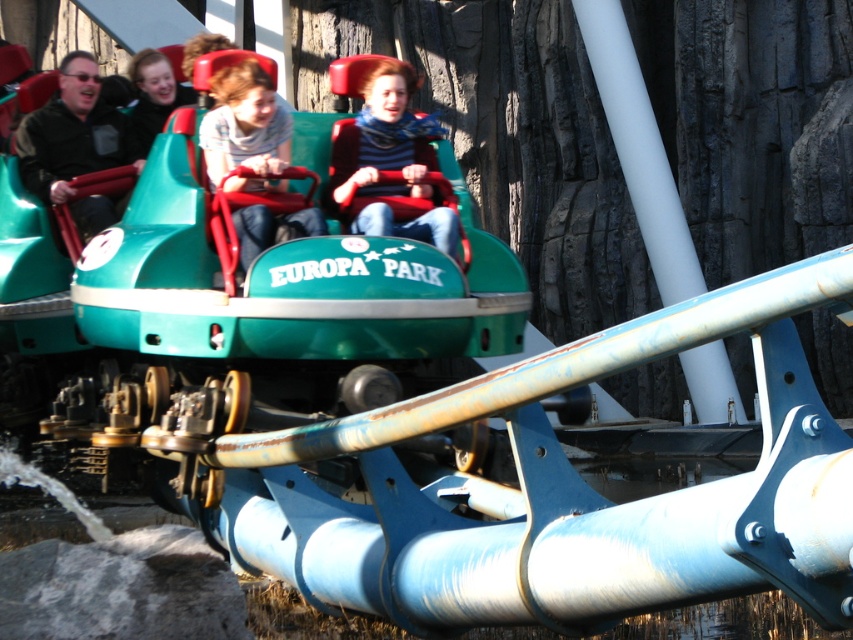
You are standing at the entrance of the water ride at Europa Park and see the matte blue jeans at center. If you want to reach the ride vehicle with the green and red seats, should you move towards or away from the jeans?

Since the matte blue jeans at center is located at point [244,124], you should move away from the jeans to reach the ride vehicle with the green and red seats as they are likely positioned further along the track.

You are standing at the entrance of the water ride at Europa Park and see two points marked on the ride track. The first point is at coordinates point (270, 168) and the second point is at point (155, 54). Which point is closer to you?

Point (270, 168) is closer to the viewer than point (155, 54).